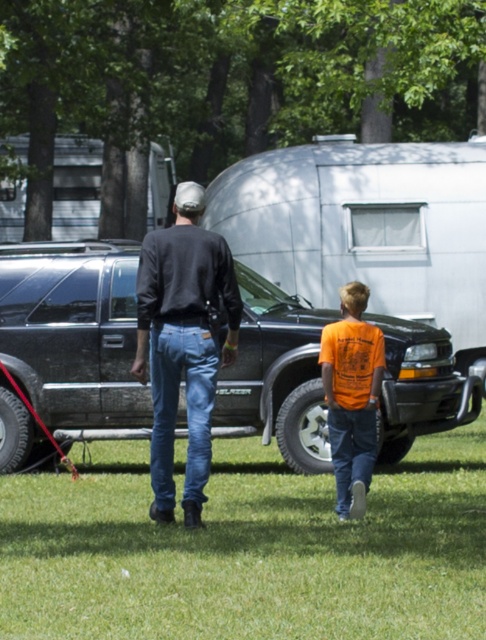
Question: Which of these objects is positioned farthest from the orange t-shirt at center?

Choices:
 (A) green grass at lower center
 (B) dark gray sweater at center

Answer: (A)

Question: Is green grass at lower center wider than dark gray sweater at center?

Choices:
 (A) no
 (B) yes

Answer: (B)

Question: Considering the relative positions of green grass at lower center and dark gray sweater at center in the image provided, where is green grass at lower center located with respect to dark gray sweater at center?

Choices:
 (A) left
 (B) right

Answer: (B)

Question: Which of the following is the closest to the observer?

Choices:
 (A) black glossy pickup truck at center
 (B) orange t-shirt at center

Answer: (B)

Question: Which object is farther from the camera taking this photo?

Choices:
 (A) black glossy pickup truck at center
 (B) dark gray sweater at center
 (C) orange t-shirt at center
 (D) green grass at lower center

Answer: (A)

Question: Is green grass at lower center smaller than black glossy pickup truck at center?

Choices:
 (A) yes
 (B) no

Answer: (B)